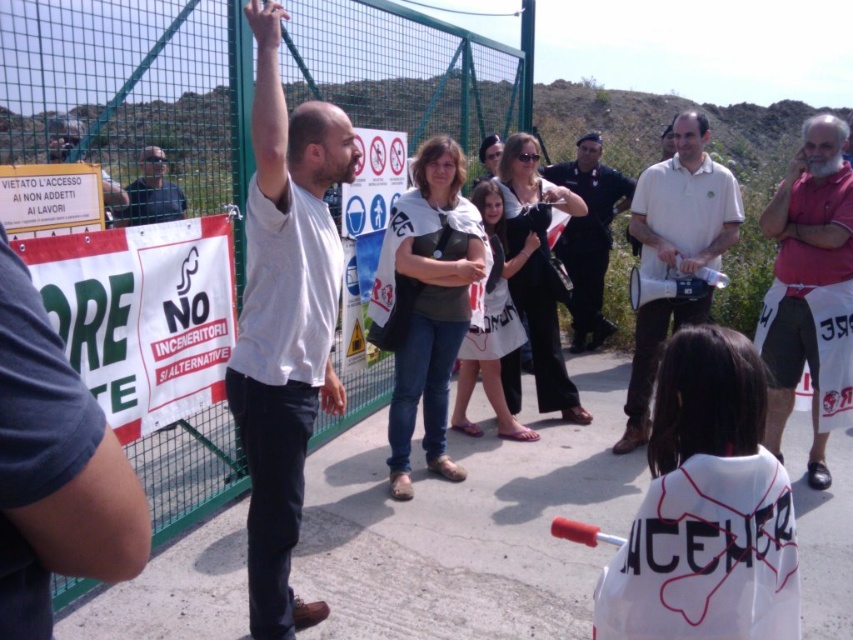
Question: Is white cotton shirt at center in front of matte black shirt at upper left?

Choices:
 (A) no
 (B) yes

Answer: (B)

Question: Which point appears closest to the camera in this image?

Choices:
 (A) (27, 237)
 (B) (314, 385)
 (C) (575, 296)
 (D) (643, 362)

Answer: (B)

Question: Among these objects, which one is farthest from the camera?

Choices:
 (A) white plastic sign at center
 (B) matte black shirt at upper left
 (C) white cotton shirt at center

Answer: (A)

Question: Which of the following is the farthest from the observer?

Choices:
 (A) (109, 224)
 (B) (54, 205)
 (C) (810, 333)

Answer: (C)

Question: Can you confirm if green fabric banner at left is positioned below matte black shirt at upper left?

Choices:
 (A) yes
 (B) no

Answer: (A)

Question: Observing the image, what is the correct spatial positioning of yellow paper sign at upper left in reference to white plastic sign at center?

Choices:
 (A) left
 (B) right

Answer: (A)